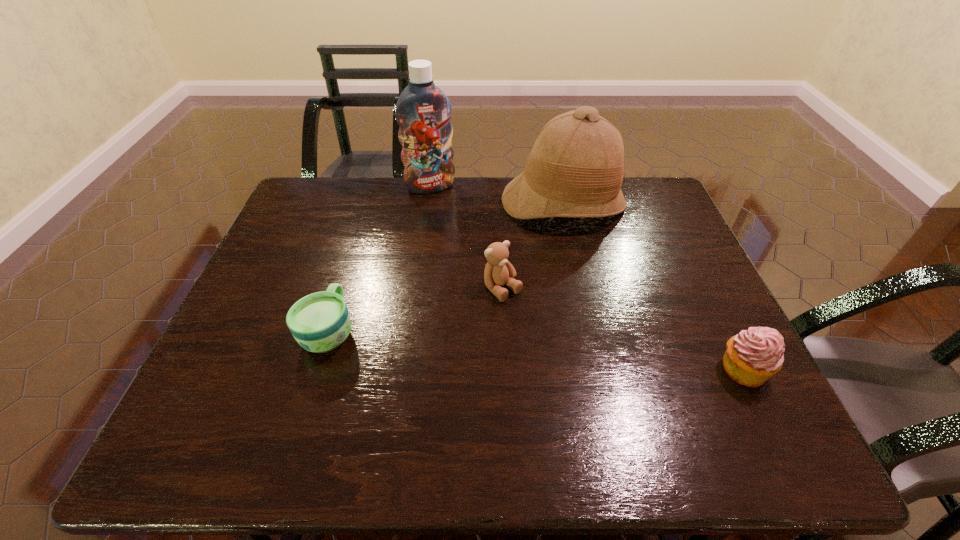
Image resolution: width=960 pixels, height=540 pixels. Find the location of `object present at the near edge`. object present at the near edge is located at coordinates (754, 355).

Where is `cupcake located in the right edge section of the desktop`? cupcake located in the right edge section of the desktop is located at coordinates (754, 355).

You are a GUI agent. You are given a task and a screenshot of the screen. Output one action in this format:
    pyautogui.click(x=<x>, y=<y>)
    Task: Click on the hat at the right edge
    The image size is (960, 540).
    Given the screenshot: What is the action you would take?
    pos(575,169)

You are a GUI agent. You are given a task and a screenshot of the screen. Output one action in this format:
    pyautogui.click(x=<x>, y=<y>)
    Task: Click on the object that is at the far right corner
    
    Given the screenshot: What is the action you would take?
    pyautogui.click(x=575, y=169)

You are a GUI agent. You are given a task and a screenshot of the screen. Output one action in this format:
    pyautogui.click(x=<x>, y=<y>)
    Task: Click on the object that is at the near right corner
    
    Given the screenshot: What is the action you would take?
    pyautogui.click(x=754, y=355)

The height and width of the screenshot is (540, 960). What are the coordinates of `free region at the far edge of the desktop` in the screenshot? It's located at pyautogui.click(x=428, y=204).

The image size is (960, 540). Identify the location of vacant space at the near edge of the desktop. (300, 409).

At what (x,y) coordinates should I click in order to perform the action: click on vacant space at the left edge. Please return your answer as a coordinate pair (x, y). Image resolution: width=960 pixels, height=540 pixels. Looking at the image, I should click on (290, 246).

You are a GUI agent. You are given a task and a screenshot of the screen. Output one action in this format:
    pyautogui.click(x=<x>, y=<y>)
    Task: Click on the free space at the far left corner of the desktop
    
    Given the screenshot: What is the action you would take?
    pyautogui.click(x=343, y=191)

Find the location of `vacant space at the near left corner`. vacant space at the near left corner is located at coordinates (222, 392).